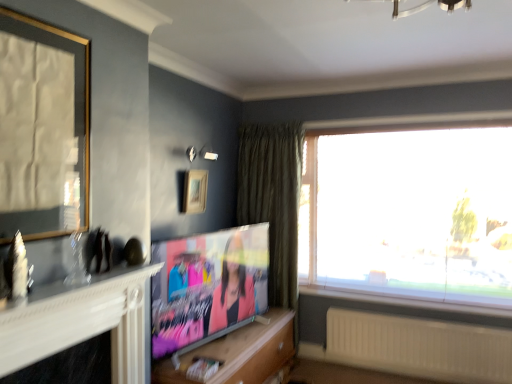
Question: Does point (112, 283) appear closer or farther from the camera than point (278, 240)?

Choices:
 (A) farther
 (B) closer

Answer: (B)

Question: From the image's perspective, is white glossy fireplace at left above or below green velvet curtain at center?

Choices:
 (A) below
 (B) above

Answer: (A)

Question: Estimate the real-world distances between objects in this image. Which object is farther from the matte paper magazine at lower center?

Choices:
 (A) white glossy fireplace at left
 (B) wooden cabinet at center
 (C) gold-framed mirror at upper left, which is counted as the second picture frame, starting from the right
 (D) green velvet curtain at center
 (E) wooden picture frame at upper center, the 2th picture frame positioned from the front

Answer: (D)

Question: Which of these objects is positioned closest to the wooden picture frame at upper center, the 2th picture frame positioned from the front?

Choices:
 (A) wooden cabinet at center
 (B) matte black tv at center
 (C) matte paper magazine at lower center
 (D) white ribbed radiator at lower right
 (E) white glossy fireplace at left

Answer: (B)